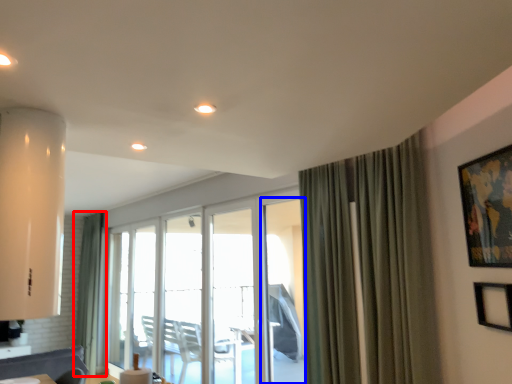
Question: Which object appears farthest to the camera in this image, curtain (highlighted by a red box) or screen door (highlighted by a blue box)?

Choices:
 (A) curtain
 (B) screen door

Answer: (A)